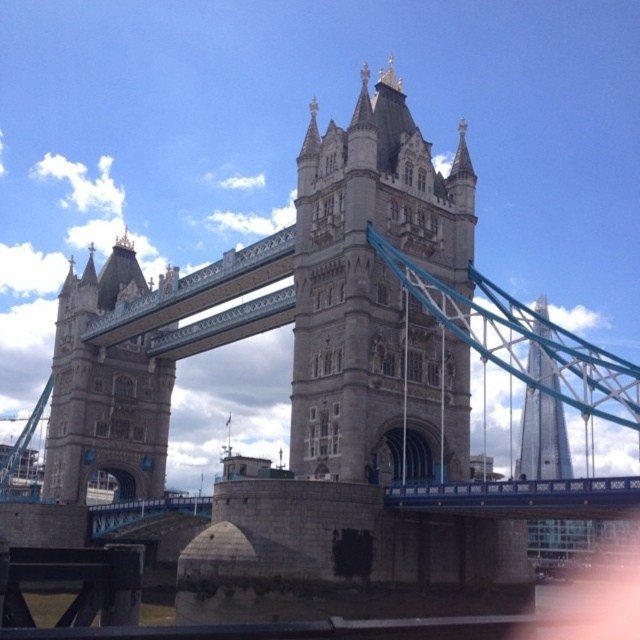
You are standing at the base of the gray stone tower at center, and you want to take a photo of it with your camera. The camera has a maximum zoom range that can capture objects up to 60 meters away. Will you be able to capture the entire tower in the photo without moving closer?

The gray stone tower at center and camera are 65.19 meters apart from each other. Since the maximum zoom range is 60 meters, you will not be able to capture the entire tower without moving closer.

You are standing on the walkway of the Tower Bridge and notice two points marked on the structure. The first point is at coordinates point [356,326], and the second is at point [138,355]. Which of these points is closer to your current position on the walkway?

Point [356,326] is closer to the viewer than point [138,355], so the first point is closer to your current position on the walkway.